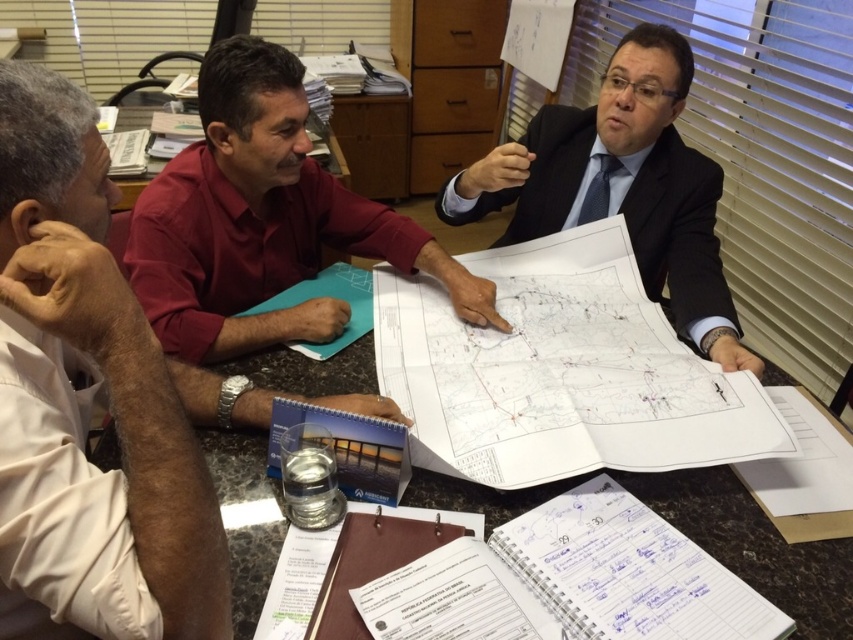
You are a new intern in the office and need to place a small sticky note on the white paper at center. According to the scene description, where exactly should you place the sticky note?

The white paper at center is located at point [560,371], so you should place the sticky note there.

What is located at the coordinates point (560, 371)?

The white paper at center is located at point (560, 371).

You are an office assistant who needs to place a new document on the table without covering any existing items. Given the white paper at center and the clear plastic water at lower center, which item should you avoid placing the document over to ensure it doesn

The white paper at center is taller than the clear plastic water at lower center. Therefore, placing the document over the white paper at center is more likely to block important content due to its height.